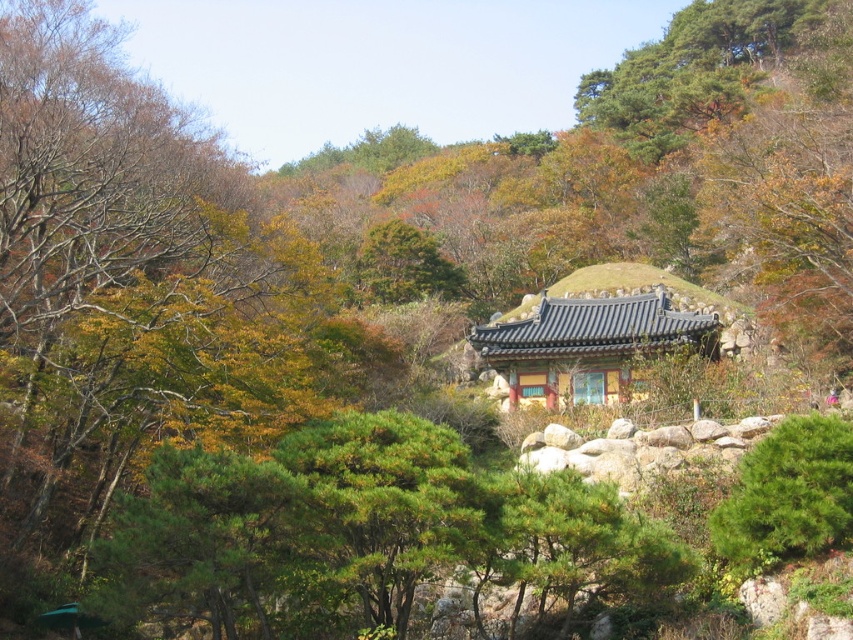
Where is `yellowish wood temple at center`? This screenshot has height=640, width=853. yellowish wood temple at center is located at coordinates (x=587, y=346).

Which is behind, point (579, 376) or point (776, 516)?

Positioned behind is point (579, 376).

Which is behind, point (585, 305) or point (833, 467)?

The point (585, 305) is behind.

Find the location of a particular element. Image resolution: width=853 pixels, height=640 pixels. yellowish wood temple at center is located at coordinates (587, 346).